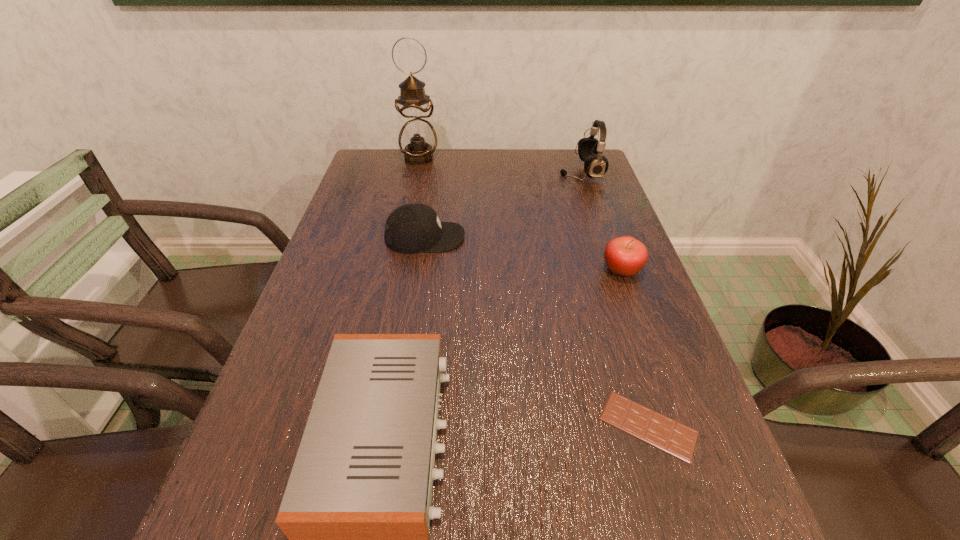
The width and height of the screenshot is (960, 540). I want to click on free space between the third farthest object and the apple, so (x=523, y=253).

At what (x,y) coordinates should I click in order to perform the action: click on empty location between the shortest object and the fourth nearest object. Please return your answer as a coordinate pair (x, y). This screenshot has width=960, height=540. Looking at the image, I should click on pyautogui.click(x=537, y=332).

Locate which object is the second closest to the radio receiver. Please provide its 2D coordinates. Your answer should be formatted as a tuple, i.e. [(x, y)], where the tuple contains the x and y coordinates of a point satisfying the conditions above.

[(412, 228)]

Find the location of a particular element. This screenshot has width=960, height=540. the closest object to the third nearest object is located at coordinates (662, 432).

You are a GUI agent. You are given a task and a screenshot of the screen. Output one action in this format:
    pyautogui.click(x=<x>, y=<y>)
    Task: Click on the free space in the image that satisfies the following two spatial constraints: 1. with the microphone on the side of the headset; 2. on the back side of the third nearest object
    This screenshot has width=960, height=540.
    Given the screenshot: What is the action you would take?
    pyautogui.click(x=614, y=269)

Find the location of a particular element. vacant space that satisfies the following two spatial constraints: 1. with the microphone on the side of the fourth farthest object; 2. on the left side of the headset is located at coordinates (614, 269).

Where is `vacant position in the image that satisfies the following two spatial constraints: 1. on the front-facing side of the third farthest object; 2. on the left side of the apple`? vacant position in the image that satisfies the following two spatial constraints: 1. on the front-facing side of the third farthest object; 2. on the left side of the apple is located at coordinates (420, 269).

You are a GUI agent. You are given a task and a screenshot of the screen. Output one action in this format:
    pyautogui.click(x=<x>, y=<y>)
    Task: Click on the free space that satisfies the following two spatial constraints: 1. on the front-facing side of the shortest object; 2. on the right side of the cap
    The height and width of the screenshot is (540, 960).
    Given the screenshot: What is the action you would take?
    pyautogui.click(x=396, y=426)